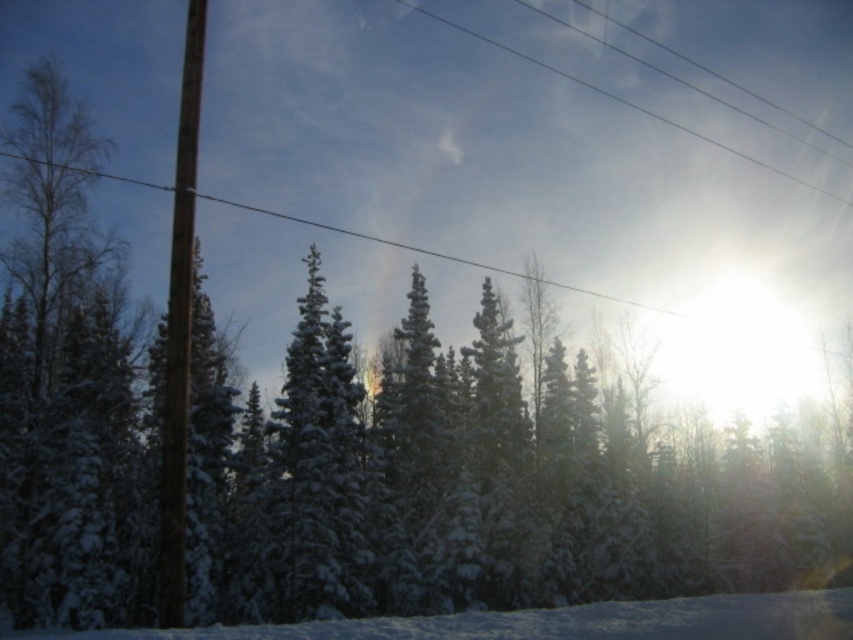
Question: Which object appears farthest from the camera in this image?

Choices:
 (A) clear plastic power lines at upper center
 (B) white snow at lower center

Answer: (A)

Question: Does white snow at lower center have a greater width compared to clear plastic power lines at upper center?

Choices:
 (A) no
 (B) yes

Answer: (A)

Question: Can you confirm if white snow at lower center is thinner than clear plastic power lines at upper center?

Choices:
 (A) yes
 (B) no

Answer: (A)

Question: Is white snow at lower center bigger than clear plastic power lines at upper center?

Choices:
 (A) no
 (B) yes

Answer: (A)